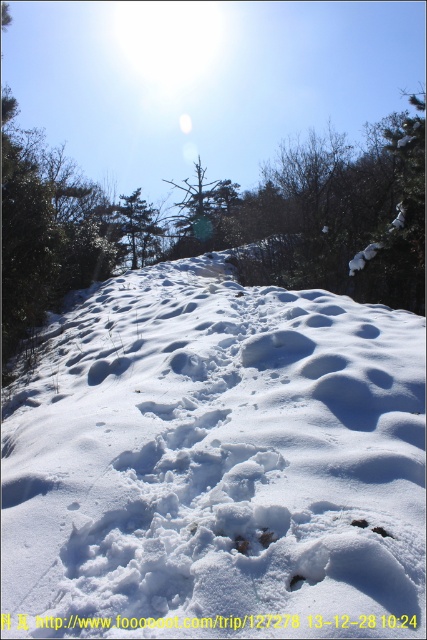
Looking at this image, you are an observer standing in the snowy landscape. You notice two green matte trees in the scene. Which tree, the green matte tree at center or the green matte tree at upper center, appears closer to you?

The green matte tree at center appears closer because it is positioned over the green matte tree at upper center, indicating it is in front.